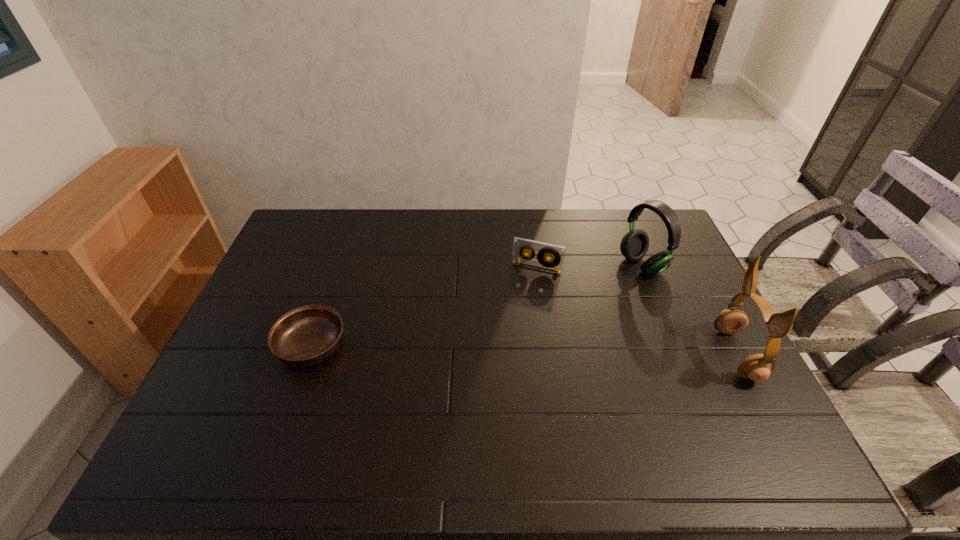
Find the location of `headset that is at the right edge`. headset that is at the right edge is located at coordinates (634, 245).

You are a GUI agent. You are given a task and a screenshot of the screen. Output one action in this format:
    pyautogui.click(x=<x>, y=<y>)
    Task: Click on the object that is at the far right corner
    
    Given the screenshot: What is the action you would take?
    pyautogui.click(x=634, y=245)

The height and width of the screenshot is (540, 960). In the image, there is a desktop. In order to click on vacant space at the far edge in this screenshot , I will do `click(371, 211)`.

In the image, there is a desktop. Find the location of `vacant space at the near edge`. vacant space at the near edge is located at coordinates (548, 402).

Locate an element on the screen. The width and height of the screenshot is (960, 540). vacant space at the left edge of the desktop is located at coordinates (320, 254).

In the image, there is a desktop. At what (x,y) coordinates should I click in order to perform the action: click on free space at the right edge. Please return your answer as a coordinate pair (x, y). The height and width of the screenshot is (540, 960). Looking at the image, I should click on (668, 301).

In the image, there is a desktop. Identify the location of vacant space at the far left corner. click(x=335, y=218).

Find the location of a particular element. Image resolution: width=960 pixels, height=540 pixels. vacant space that's between the videotape and the shortest object is located at coordinates pyautogui.click(x=424, y=307).

Locate an element on the screen. The image size is (960, 540). free point between the third tallest object and the earphone is located at coordinates (636, 311).

The image size is (960, 540). What are the coordinates of `vacant region between the shortest object and the headset` in the screenshot? It's located at (477, 306).